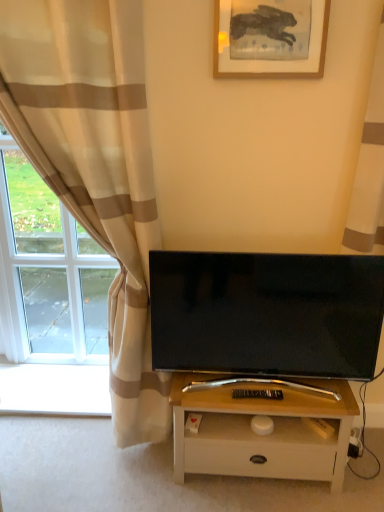
I want to click on free space to the left of black plastic remote control at center, so (218, 393).